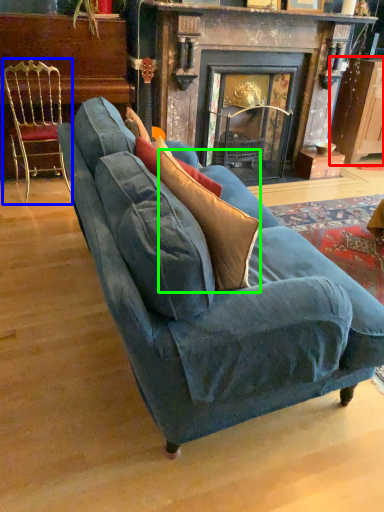
Question: Which object is the farthest from cabinetry (highlighted by a red box)? Choose among these: chair (highlighted by a blue box) or throw pillow (highlighted by a green box).

Choices:
 (A) chair
 (B) throw pillow

Answer: (B)